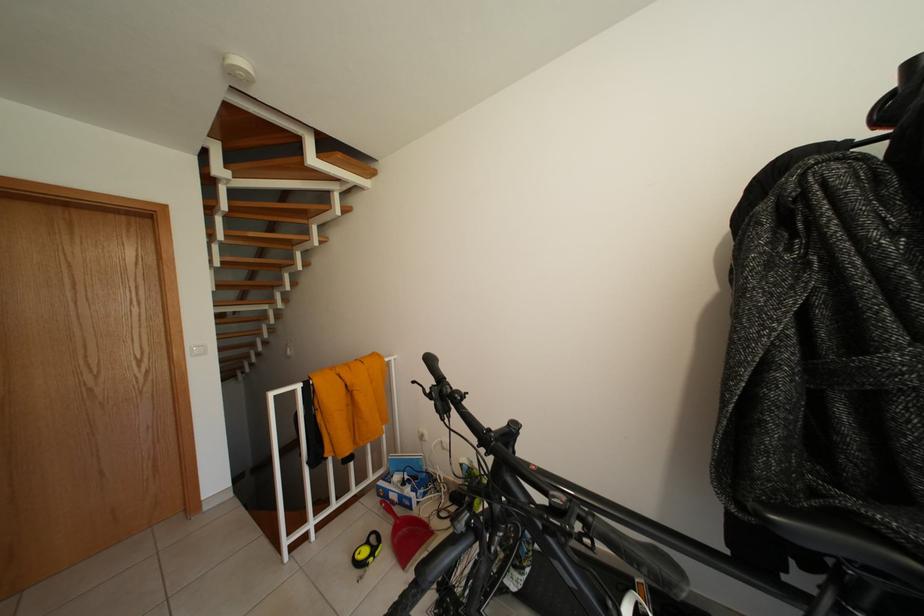
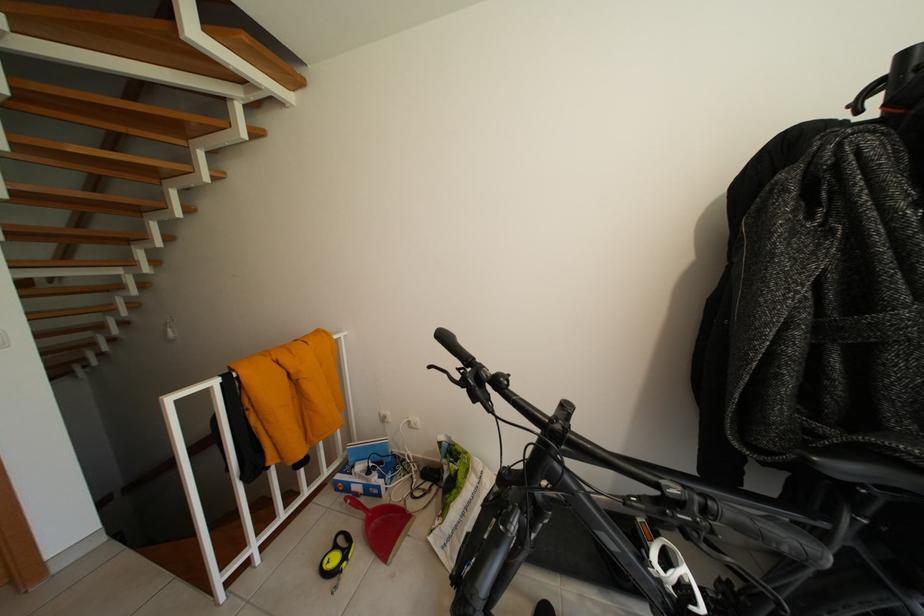
Where in the second image is the point corresponding to the point at 411,488 from the first image?

(378, 477)